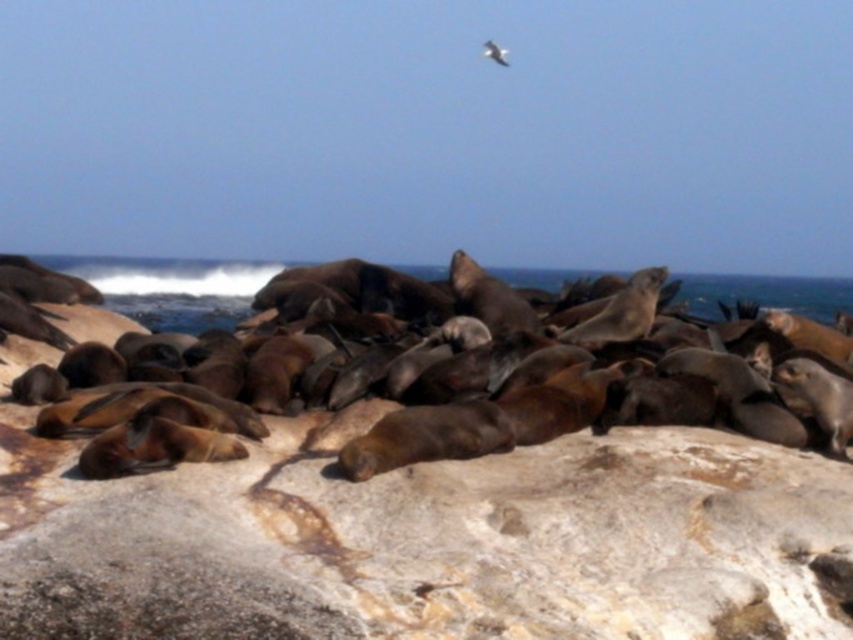
You are a wildlife photographer aiming to capture a closeup of the brown fur seals at center. You notice the brown rough rock at center in the background. Which object is smaller in size between the two?

The brown rough rock at center is smaller in size compared to the brown fur seals at center.

You are standing at the edge of the rocky shore where the sea lions are resting. You see two points marked on the rocks. The first point is at coordinates point (560, 611), and the second point is at coordinates point (735, 294). If you want to walk from the first point to the second point, which direction should you move relative to your current position?

To move from point (560, 611) to point (735, 294), you should move towards the upper left direction since point (560, 611) is in front of point (735, 294).

You are standing on the rocky shore and see the brown rough rock at center and the white feathered bird at upper center. Which object is closer to you?

The brown rough rock at center is closer to you because it is in front of the white feathered bird at upper center.